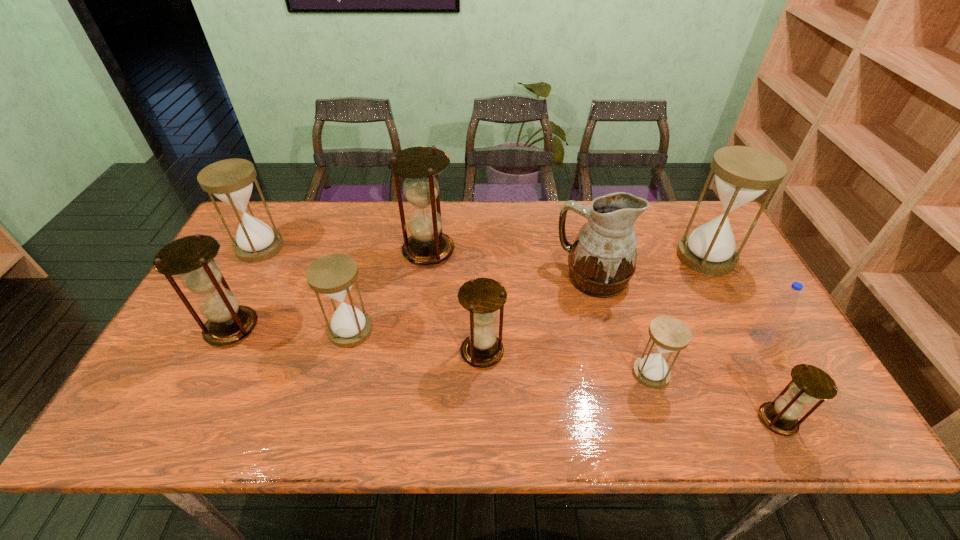
This screenshot has width=960, height=540. I want to click on water bottle, so click(772, 321).

Identify the location of the second white hourglass from right to left. (669, 334).

Locate an element on the screen. The width and height of the screenshot is (960, 540). the third hourglass from right to left is located at coordinates (669, 334).

The width and height of the screenshot is (960, 540). I want to click on the rightmost brown hourglass, so click(809, 383).

You are a GUI agent. You are given a task and a screenshot of the screen. Output one action in this format:
    pyautogui.click(x=<x>, y=<y>)
    Task: Click on the nearest brown hourglass
    This screenshot has width=960, height=540.
    Given the screenshot: What is the action you would take?
    pyautogui.click(x=809, y=383)

Where is `vacant space located 0.130m on the left of the third brown hourglass from right to left`? vacant space located 0.130m on the left of the third brown hourglass from right to left is located at coordinates (360, 251).

In order to click on vacant region located 0.070m on the back of the biggest white hourglass in this screenshot , I will do pos(688,225).

Where is `free spot located from the spout of the brown pitcher`? This screenshot has width=960, height=540. free spot located from the spout of the brown pitcher is located at coordinates (497, 278).

I want to click on free space located 0.090m from the spout of the brown pitcher, so click(x=525, y=278).

You are a GUI agent. You are given a task and a screenshot of the screen. Output one action in this format:
    pyautogui.click(x=<x>, y=<y>)
    Task: Click on the vacant space located from the spout of the brown pitcher
    The image size is (960, 540).
    Given the screenshot: What is the action you would take?
    pyautogui.click(x=539, y=278)